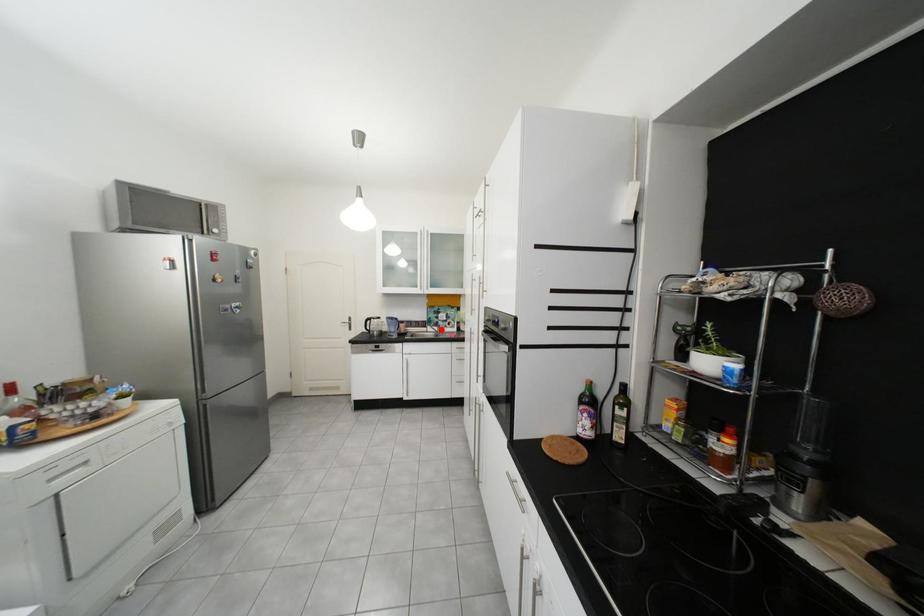
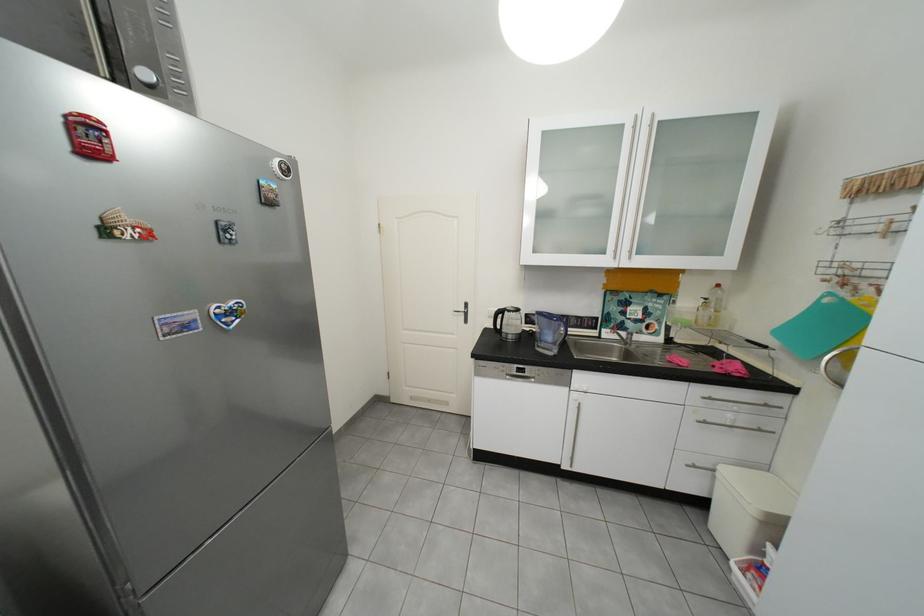
Question: I am providing you with two images of the same scene from different viewpoints. A red point is marked on the first image. At the location where the point appears in image 1, is it still visible in image 2?

Choices:
 (A) Yes
 (B) No

Answer: (A)